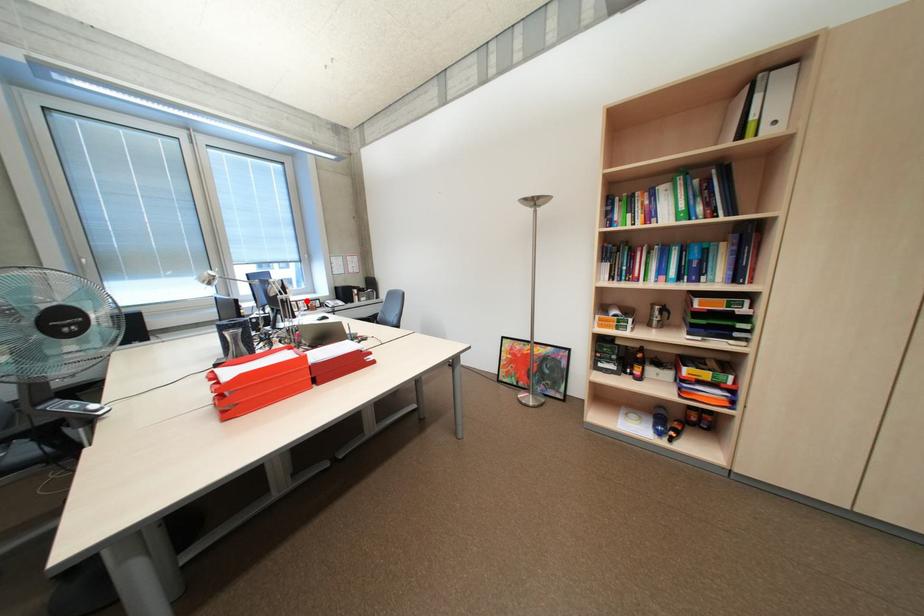
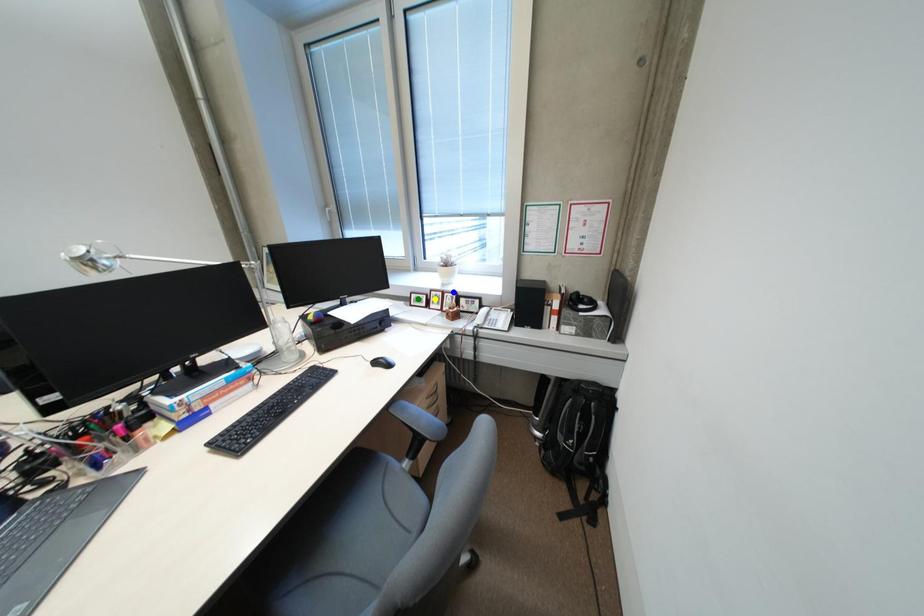
Question: I am providing you with two images of the same scene from different viewpoints. A red point is marked on the first image. You are given multiple points on the second image. Which spot in image 2 lines up with the point in image 1?

Choices:
 (A) blue point
 (B) yellow point
 (C) green point

Answer: (A)